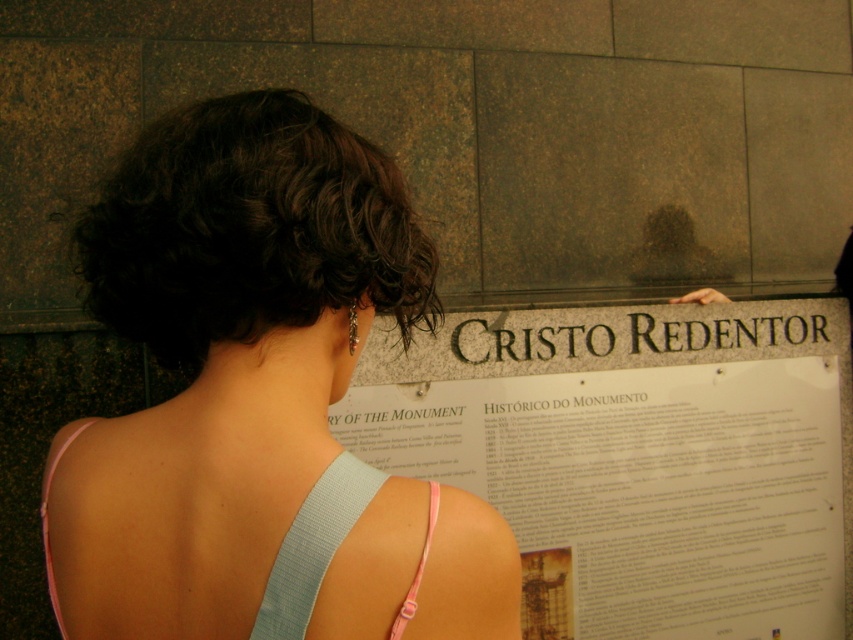
Between dark brown curly hair at upper left and light blue fabric strap at upper center, which one has less height?

light blue fabric strap at upper center is shorter.

The width and height of the screenshot is (853, 640). What are the coordinates of `dark brown curly hair at upper left` in the screenshot? It's located at (248, 228).

The width and height of the screenshot is (853, 640). I want to click on dark brown curly hair at upper left, so click(x=248, y=228).

Does light blue fabric tank top at center have a smaller size compared to dark brown curly hair at upper left?

No.

Measure the distance between light blue fabric tank top at center and camera.

They are 30.16 inches apart.

Is point (383, 291) closer to viewer compared to point (387, 170)?

Yes, it is.

Where is `light blue fabric tank top at center`? The height and width of the screenshot is (640, 853). light blue fabric tank top at center is located at coordinates (258, 400).

Is point (247, 442) positioned after point (328, 531)?

Yes.

Can you confirm if light blue fabric tank top at center is smaller than light blue fabric strap at upper center?

No, light blue fabric tank top at center is not smaller than light blue fabric strap at upper center.

This screenshot has width=853, height=640. Identify the location of light blue fabric tank top at center. (258, 400).

Identify the location of light blue fabric tank top at center. This screenshot has width=853, height=640. (258, 400).